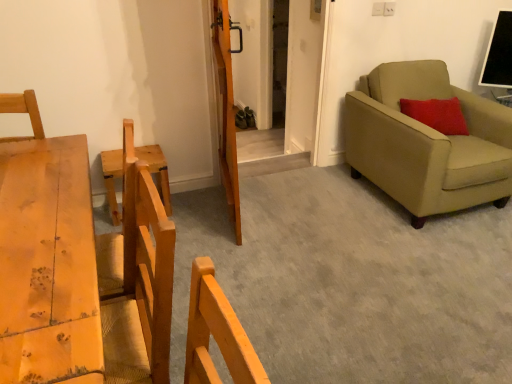
At what (x,y) coordinates should I click in order to perform the action: click on vacant area that lies between wooden door at center and beige fabric armchair at right. Please return your answer as a coordinate pair (x, y). The image size is (512, 384). Looking at the image, I should click on (314, 200).